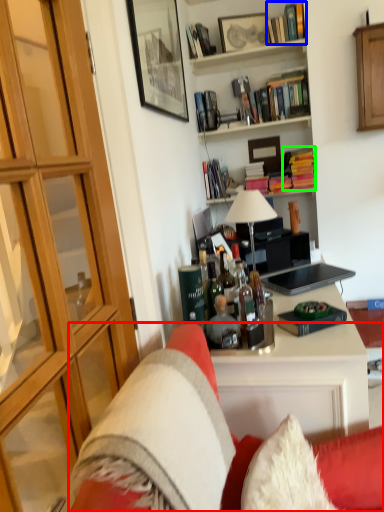
Question: Estimate the real-world distances between objects in this image. Which object is closer to studio couch (highlighted by a red box), book (highlighted by a blue box) or book (highlighted by a green box)?

Choices:
 (A) book
 (B) book

Answer: (B)